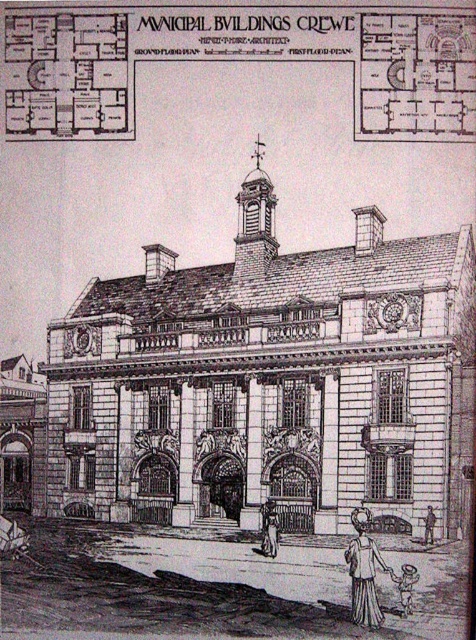
You are an architect reviewing the Municipal Buildings in Crewe. You notice the stone textured church at center and the smooth gray statue at center in the design. Which one do you think occupies more space in the architectural rendering?

The stone textured church at center has a larger size compared to the smooth gray statue at center, so it occupies more space in the architectural rendering.

You are an architect reviewing the Municipal Buildings in Crewe rendering. You need to determine which of the two points, point (77, 316) or point (263, 516), is closer to the camera. Based on the rendering, which point is closer?

Point (77, 316) is further to the camera than point (263, 516). Therefore, point (263, 516) is closer to the camera.